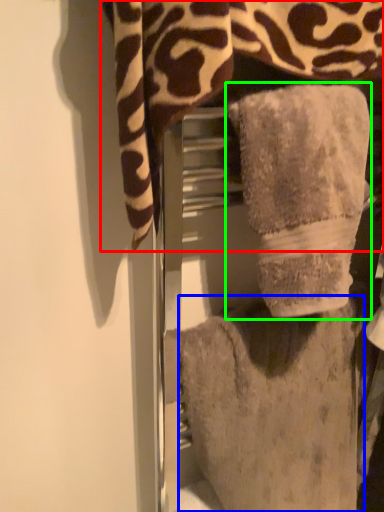
Question: Which object is positioned closest to towel (highlighted by a red box)? Select from towel (highlighted by a blue box) and towel (highlighted by a green box).

Choices:
 (A) towel
 (B) towel

Answer: (B)